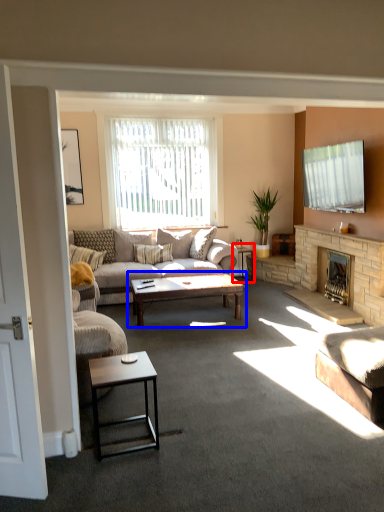
Question: Among these objects, which one is farthest to the camera, side table (highlighted by a red box) or coffee table (highlighted by a blue box)?

Choices:
 (A) side table
 (B) coffee table

Answer: (A)